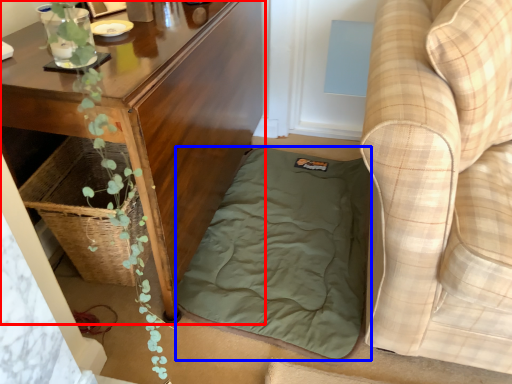
Question: Which object is further to the camera taking this photo, table (highlighted by a red box) or mattress (highlighted by a blue box)?

Choices:
 (A) table
 (B) mattress

Answer: (B)